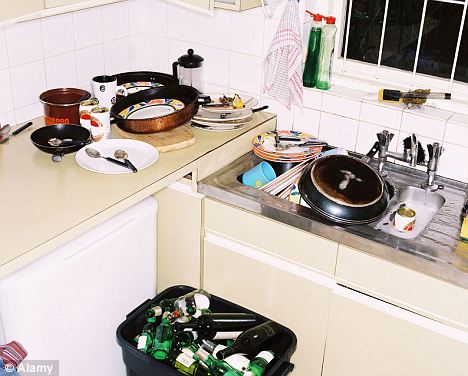
Where is `cuppboard`? The width and height of the screenshot is (468, 376). cuppboard is located at coordinates (294, 278).